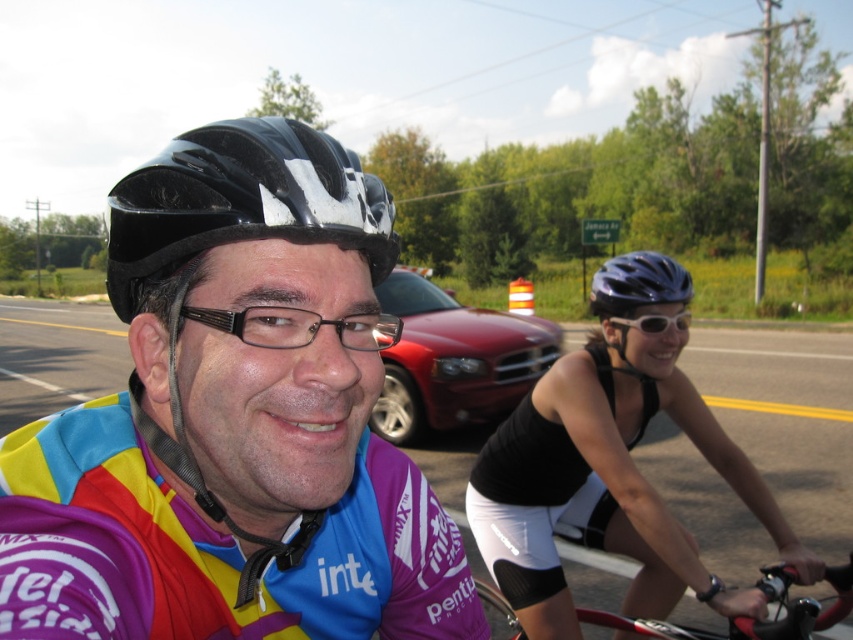
Based on the scene description, where is the matte cycling jersey at center located in the image?

The matte cycling jersey at center is located at the 2D coordinates point (234, 424) in the image.

You are a photographer standing at the starting line of a bicycle race. You want to capture a photo of the black matte bicycle at lower right and the cyclist in the foreground. How far apart should you position them in the photo to ensure both are clearly visible?

The cyclists are 1.52 meters apart, so to ensure both the black matte bicycle at lower right and the cyclist in the foreground are clearly visible in the photo, they should be positioned 1.52 meters apart.

You are a photographer positioned at the side of the road. You need to capture a photo where both the matte cycling jersey at center and the shiny red car at center are visible. Which object should you adjust your camera focus to first to ensure both are in frame?

The matte cycling jersey at center is thinner than the shiny red car at center, so you should focus on the shiny red car at center first since it takes up more space in the frame and requires proper framing before adjusting for the smaller matte cycling jersey at center.